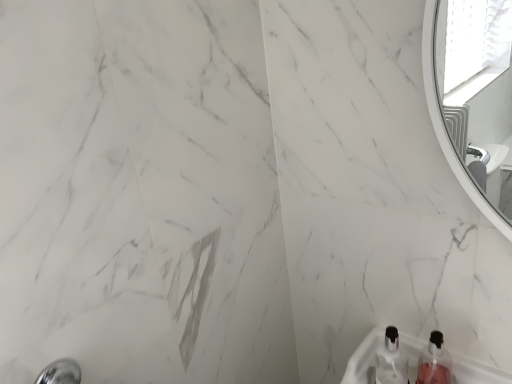
Question: From a real-world perspective, relative to pink translucent bottle at lower right, the first bottle viewed from the right, is clear plastic bottle at lower center, acting as the 2th bottle starting from the right, vertically above or below?

Choices:
 (A) below
 (B) above

Answer: (B)

Question: Is clear plastic bottle at lower center, which is the first bottle in left-to-right order, wider or thinner than pink translucent bottle at lower right, the second bottle when ordered from left to right?

Choices:
 (A) wide
 (B) thin

Answer: (B)

Question: Relative to pink translucent bottle at lower right, the second bottle when ordered from left to right, is clear plastic bottle at lower center, acting as the 2th bottle starting from the right, in front or behind?

Choices:
 (A) front
 (B) behind

Answer: (B)

Question: In the image, is pink translucent bottle at lower right, the first bottle viewed from the right, positioned in front of or behind clear plastic bottle at lower center, which is the first bottle in left-to-right order?

Choices:
 (A) behind
 (B) front

Answer: (B)

Question: From a real-world perspective, relative to clear plastic bottle at lower center, which is the first bottle in left-to-right order, is pink translucent bottle at lower right, the second bottle when ordered from left to right, vertically above or below?

Choices:
 (A) above
 (B) below

Answer: (B)

Question: From the image's perspective, is pink translucent bottle at lower right, the second bottle when ordered from left to right, positioned above or below clear plastic bottle at lower center, which is the first bottle in left-to-right order?

Choices:
 (A) above
 (B) below

Answer: (B)

Question: Does point (442, 370) appear closer or farther from the camera than point (407, 365)?

Choices:
 (A) farther
 (B) closer

Answer: (B)